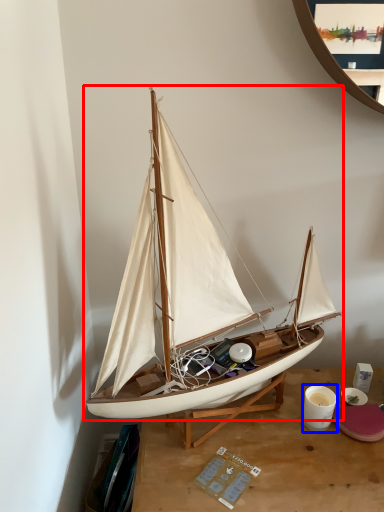
Question: Which point is closer to the camera, boat (highlighted by a red box) or coffee cup (highlighted by a blue box)?

Choices:
 (A) boat
 (B) coffee cup

Answer: (A)